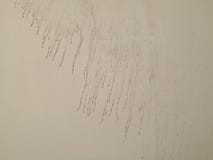
I want to click on white wall, so click(x=69, y=82).